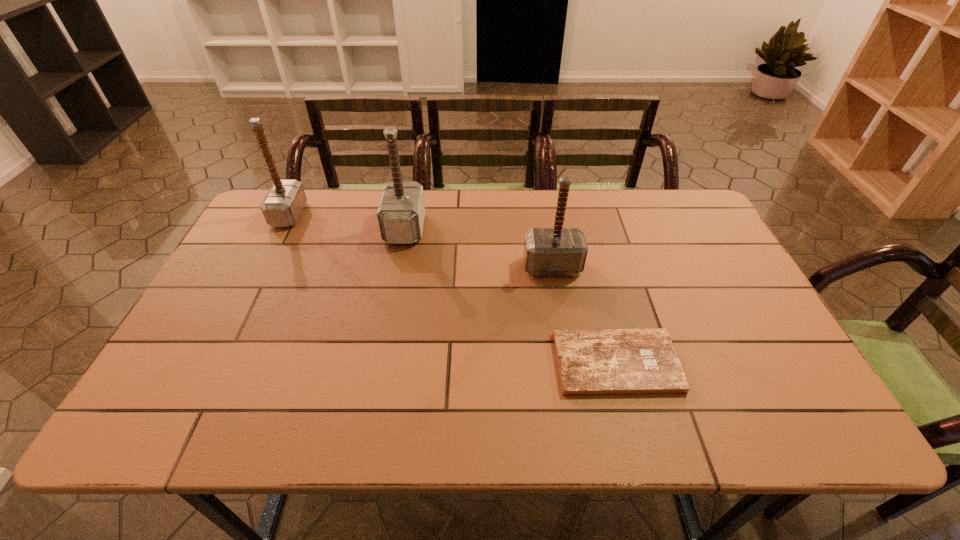
You are a GUI agent. You are given a task and a screenshot of the screen. Output one action in this format:
    pyautogui.click(x=<x>, y=<y>)
    Task: Click on the vacant area that satisfies the following two spatial constraints: 1. on the striking surface of the shortest object; 2. on the right side of the leftmost hammer
    Image resolution: width=960 pixels, height=540 pixels.
    Given the screenshot: What is the action you would take?
    pyautogui.click(x=215, y=363)

At what (x,y) coordinates should I click in order to perform the action: click on blank area in the image that satisfies the following two spatial constraints: 1. on the front side of the Bible; 2. on the left side of the rightmost hammer. Please return your answer as a coordinate pair (x, y). Looking at the image, I should click on (568, 363).

Where is `free space that satisfies the following two spatial constraints: 1. on the striking surface of the leftmost object; 2. on the right side of the second nearest object`? free space that satisfies the following two spatial constraints: 1. on the striking surface of the leftmost object; 2. on the right side of the second nearest object is located at coordinates (263, 267).

Locate an element on the screen. This screenshot has width=960, height=540. vacant point that satisfies the following two spatial constraints: 1. on the back side of the Bible; 2. for striking with the head of the second object from left to right is located at coordinates (580, 228).

Where is `vacant point that satisfies the following two spatial constraints: 1. for striking with the head of the second object from left to right; 2. on the left side of the Bible`? The width and height of the screenshot is (960, 540). vacant point that satisfies the following two spatial constraints: 1. for striking with the head of the second object from left to right; 2. on the left side of the Bible is located at coordinates (379, 363).

Find the location of a particular element. The height and width of the screenshot is (540, 960). vacant space that satisfies the following two spatial constraints: 1. for striking with the head of the second hammer from left to right; 2. on the right side of the third farthest object is located at coordinates [397, 267].